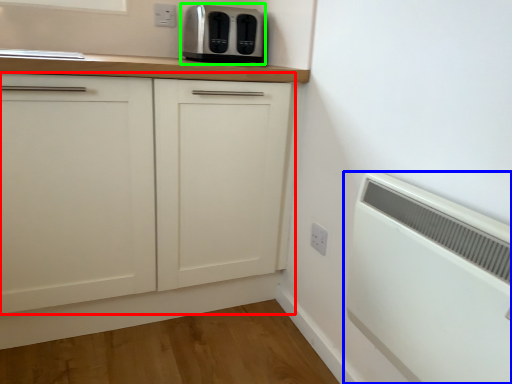
Question: Which object is positioned farthest from cabinetry (highlighted by a red box)? Select from home appliance (highlighted by a blue box) and toaster (highlighted by a green box).

Choices:
 (A) home appliance
 (B) toaster

Answer: (A)